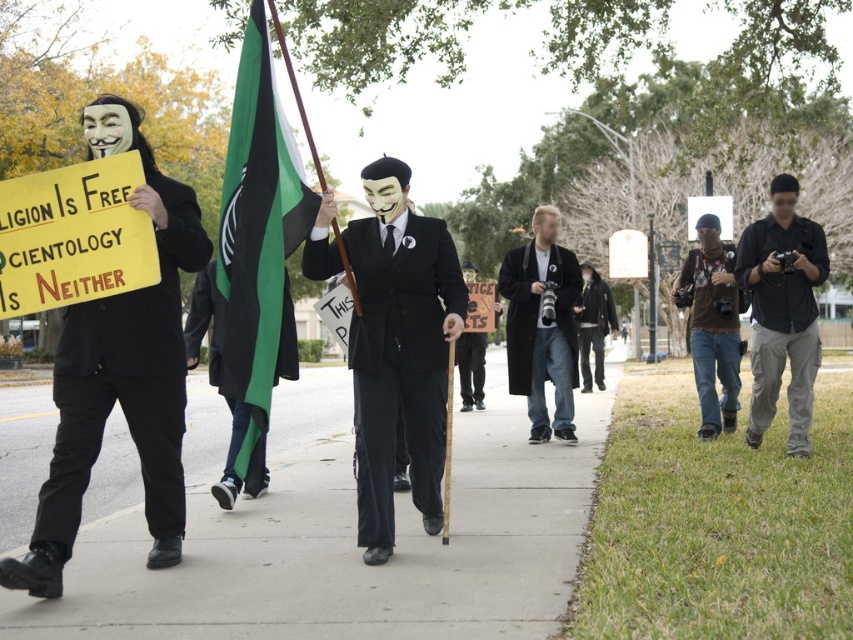
You are a photographer standing at the edge of the protest area. You want to take a photo that includes both the smooth concrete sidewalk at center and the green fabric flag at center. What is the minimum distance you need to move forward to ensure both are in frame?

The smooth concrete sidewalk at center is 5.93 feet away from the green fabric flag at center. To capture both in the same frame, you need to move forward until you are at least 5.93 feet away from the closest object, ensuring both are within your camera view.

You are a photographer at the protest scene. You want to take a photo that includes both the matte black suit at center and the black wool coat at center. Which one should you focus on to ensure the larger object is in the frame?

The matte black suit at center is larger than the black wool coat at center, so you should focus on the matte black suit at center to ensure the larger object is in the frame.